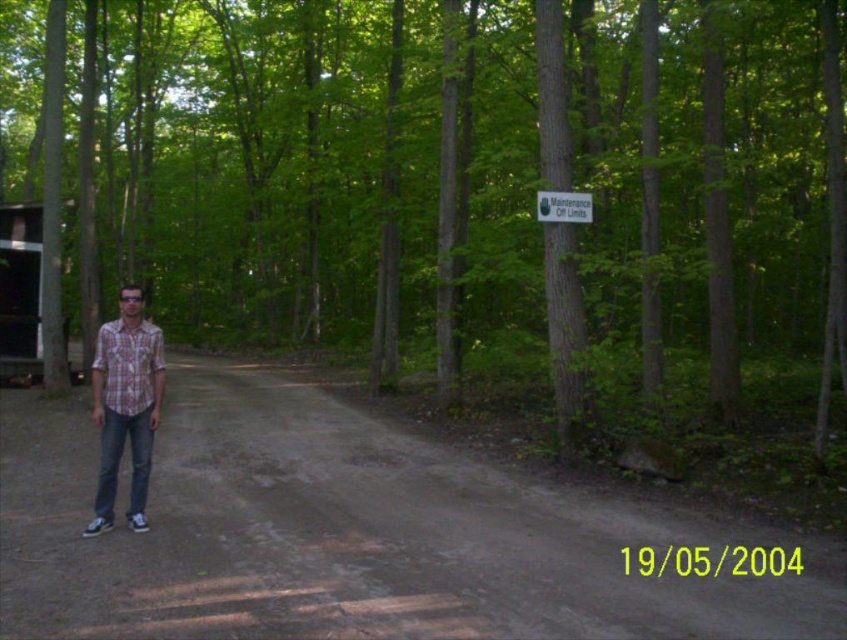
You are a hiker who wants to take a photo of the brown textured tree at center from the brown dirt track at center. Considering their relative sizes, which object would appear larger in the photo?

The brown textured tree at center would appear larger in the photo because it is much taller than the brown dirt track at center.